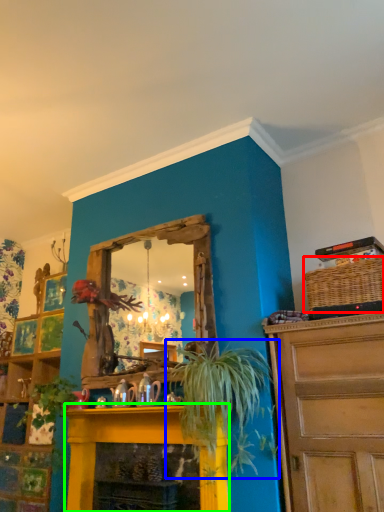
Question: Which is farther away from basket (highlighted by a red box)? houseplant (highlighted by a blue box) or fireplace (highlighted by a green box)?

Choices:
 (A) houseplant
 (B) fireplace

Answer: (B)